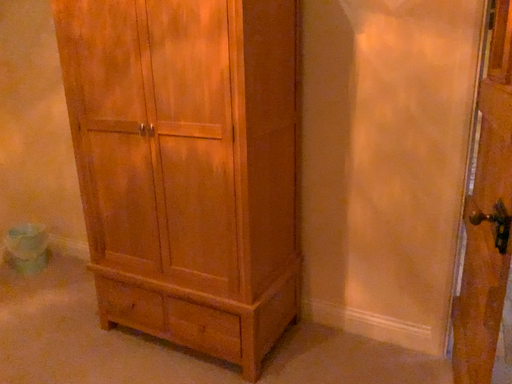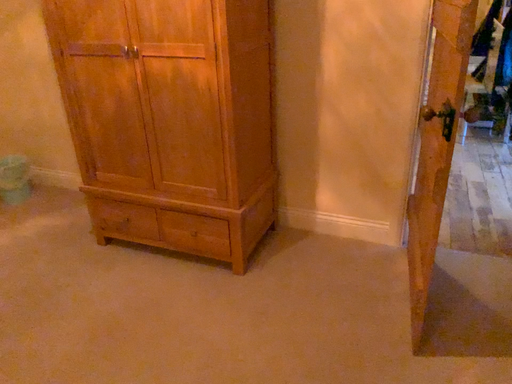
Question: Which way did the camera rotate in the video?

Choices:
 (A) rotated upward
 (B) rotated downward

Answer: (B)